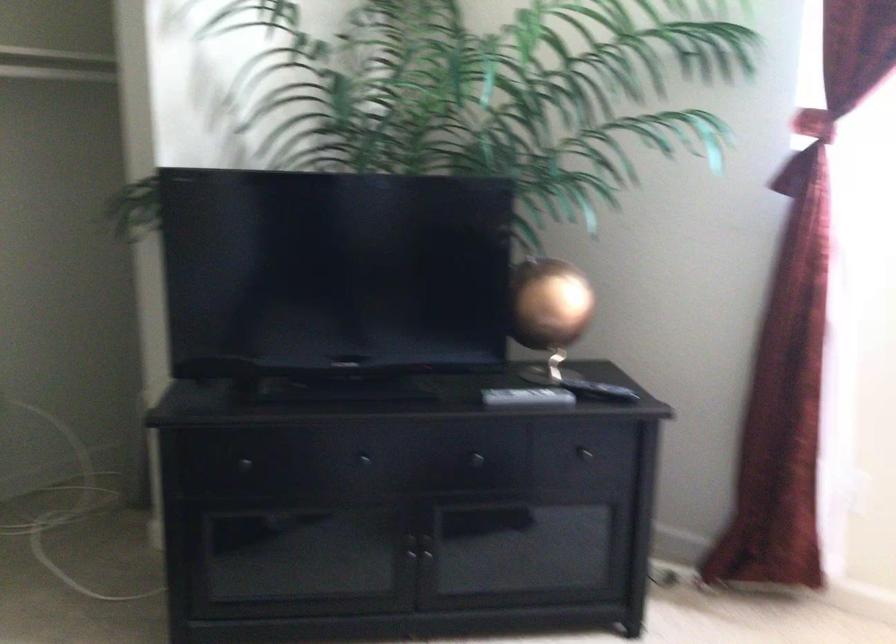
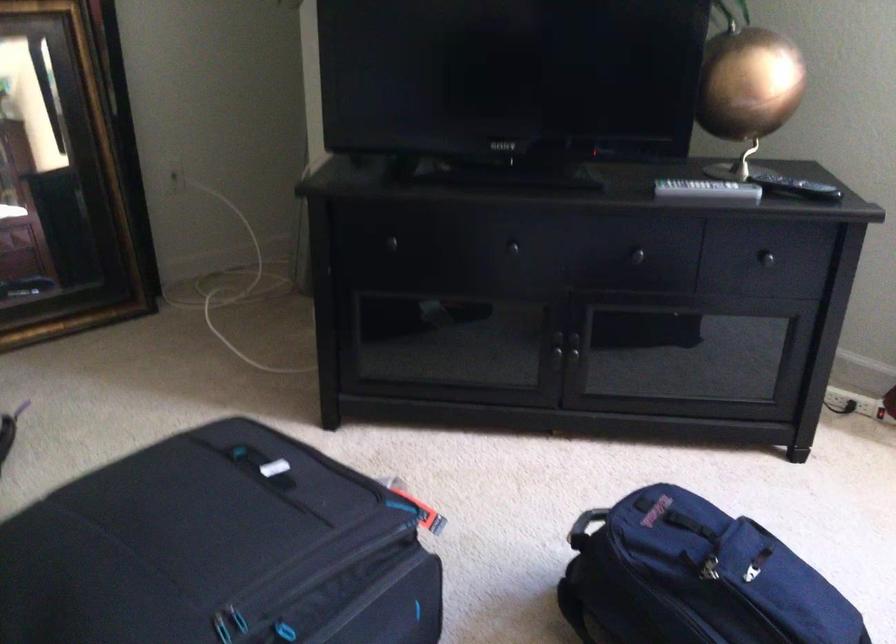
Where in the second image is the point corresponding to (x=555, y=308) from the first image?

(746, 88)